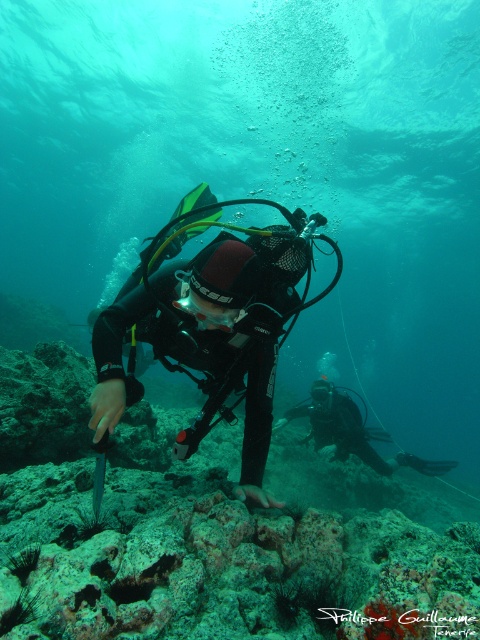
Question: Is rough textured coral reef at center thinner than black matte scuba diver at center?

Choices:
 (A) no
 (B) yes

Answer: (A)

Question: Does black matte scuba diver at center appear on the left side of clear plastic goggles at center?

Choices:
 (A) no
 (B) yes

Answer: (B)

Question: Does rough textured coral reef at center appear on the right side of clear plastic goggles at center?

Choices:
 (A) no
 (B) yes

Answer: (B)

Question: Which object is closer to the camera taking this photo?

Choices:
 (A) clear plastic goggles at center
 (B) black matte scuba diver at center
 (C) rough textured coral reef at center

Answer: (C)

Question: Which object is closer to the camera taking this photo?

Choices:
 (A) clear plastic goggles at center
 (B) black matte scuba diver at center

Answer: (B)

Question: Which object is the closest to the clear plastic goggles at center?

Choices:
 (A) rough textured coral reef at center
 (B) black matte scuba diver at center

Answer: (B)